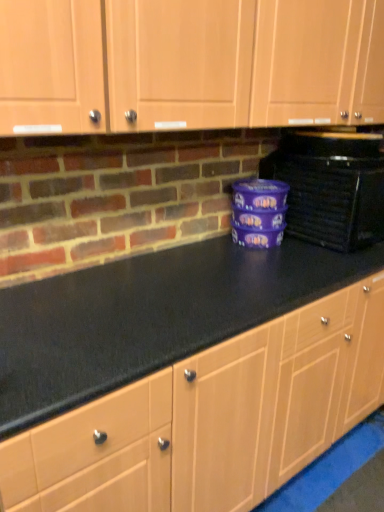
Question: From a real-world perspective, relative to black plastic toaster oven at right, is matte wood cabinets at upper center vertically above or below?

Choices:
 (A) above
 (B) below

Answer: (A)

Question: Looking at their shapes, would you say matte wood cabinets at upper center is wider or thinner than black plastic toaster oven at right?

Choices:
 (A) thin
 (B) wide

Answer: (A)

Question: From the image's perspective, is matte wood cabinets at upper center located above or below black plastic toaster oven at right?

Choices:
 (A) above
 (B) below

Answer: (A)

Question: Is black plastic toaster oven at right spatially inside matte wood cabinets at upper center, or outside of it?

Choices:
 (A) inside
 (B) outside

Answer: (B)

Question: Considering the relative positions of black plastic toaster oven at right and matte wood cabinets at upper center in the image provided, is black plastic toaster oven at right to the left or to the right of matte wood cabinets at upper center?

Choices:
 (A) left
 (B) right

Answer: (B)

Question: From the image's perspective, is black plastic toaster oven at right located above or below matte wood cabinets at upper center?

Choices:
 (A) below
 (B) above

Answer: (A)

Question: In terms of width, does black plastic toaster oven at right look wider or thinner when compared to matte wood cabinets at upper center?

Choices:
 (A) wide
 (B) thin

Answer: (A)